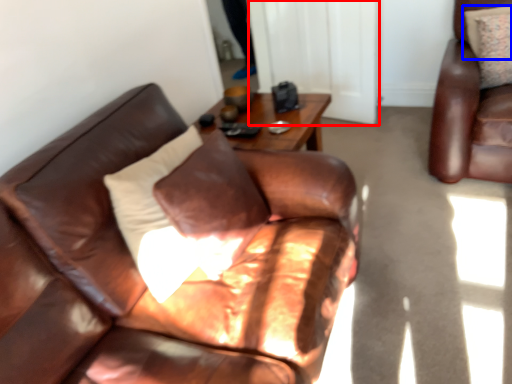
Question: Which of the following is the farthest to the observer, glass door (highlighted by a red box) or pillow (highlighted by a blue box)?

Choices:
 (A) glass door
 (B) pillow

Answer: (A)